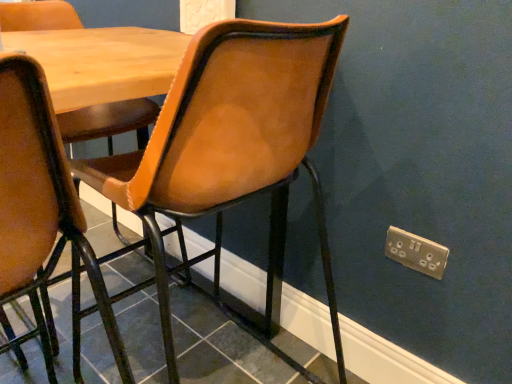
Question: Is matte black tile at lower center positioned far away from wooden table at center?

Choices:
 (A) yes
 (B) no

Answer: (B)

Question: Considering the relative sizes of matte black tile at lower center and wooden table at center in the image provided, is matte black tile at lower center bigger than wooden table at center?

Choices:
 (A) no
 (B) yes

Answer: (A)

Question: Is matte black tile at lower center turned away from wooden table at center?

Choices:
 (A) no
 (B) yes

Answer: (A)

Question: Can you confirm if matte black tile at lower center is wider than wooden table at center?

Choices:
 (A) no
 (B) yes

Answer: (B)

Question: Can you confirm if matte black tile at lower center is positioned to the right of wooden table at center?

Choices:
 (A) yes
 (B) no

Answer: (A)

Question: From a real-world perspective, is gold metallic electric outlet at lower right physically located above or below leather-like brown chair at center?

Choices:
 (A) above
 (B) below

Answer: (B)

Question: Considering the positions of point (422, 268) and point (343, 29), is point (422, 268) closer or farther from the camera than point (343, 29)?

Choices:
 (A) farther
 (B) closer

Answer: (A)

Question: Considering the positions of gold metallic electric outlet at lower right and leather-like brown chair at center in the image, is gold metallic electric outlet at lower right taller or shorter than leather-like brown chair at center?

Choices:
 (A) short
 (B) tall

Answer: (A)

Question: Would you say gold metallic electric outlet at lower right is inside or outside leather-like brown chair at center?

Choices:
 (A) inside
 (B) outside

Answer: (B)

Question: Choose the correct answer: Is gold metallic electric outlet at lower right inside wooden table at center or outside it?

Choices:
 (A) outside
 (B) inside

Answer: (A)

Question: Looking at the image, does gold metallic electric outlet at lower right seem bigger or smaller compared to wooden table at center?

Choices:
 (A) small
 (B) big

Answer: (A)

Question: From the image's perspective, is gold metallic electric outlet at lower right located above or below wooden table at center?

Choices:
 (A) below
 (B) above

Answer: (B)

Question: From their relative heights in the image, would you say gold metallic electric outlet at lower right is taller or shorter than wooden table at center?

Choices:
 (A) tall
 (B) short

Answer: (B)

Question: Is matte black tile at lower center bigger or smaller than leather-like brown chair at center?

Choices:
 (A) big
 (B) small

Answer: (B)

Question: From a real-world perspective, is matte black tile at lower center physically located above or below leather-like brown chair at center?

Choices:
 (A) below
 (B) above

Answer: (A)